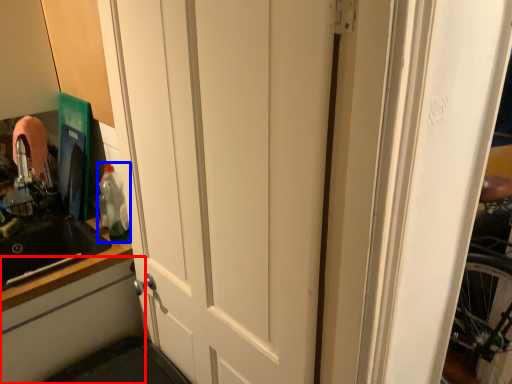
Question: Which object appears farthest to the camera in this image, cabinetry (highlighted by a red box) or bottle (highlighted by a blue box)?

Choices:
 (A) cabinetry
 (B) bottle

Answer: (B)